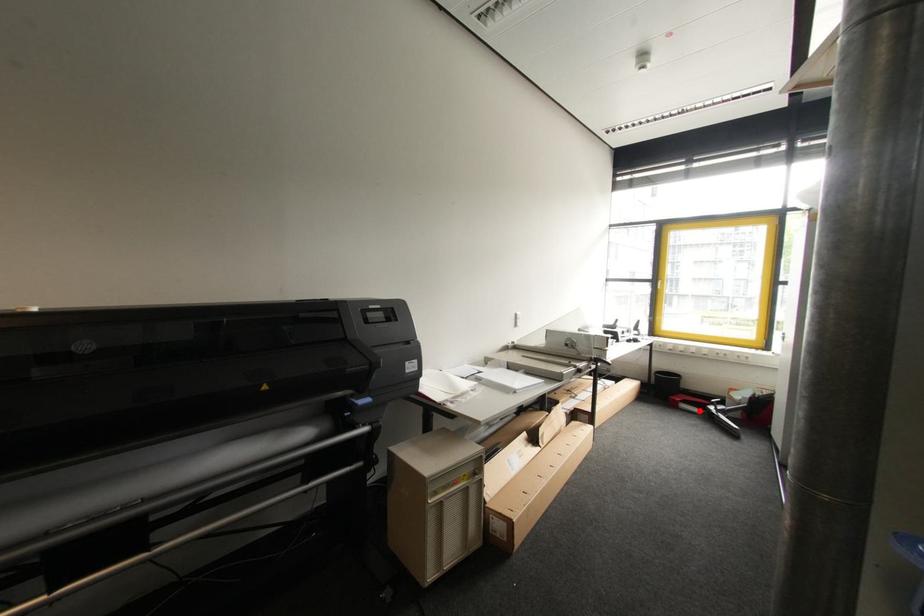
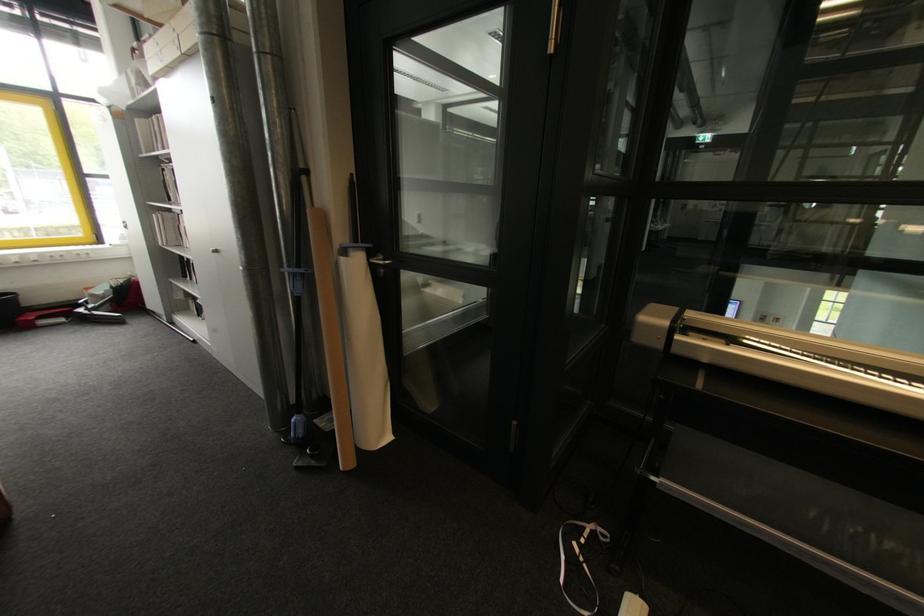
Where in the second image is the point corresponding to the highlighted location from the first image?

(66, 321)